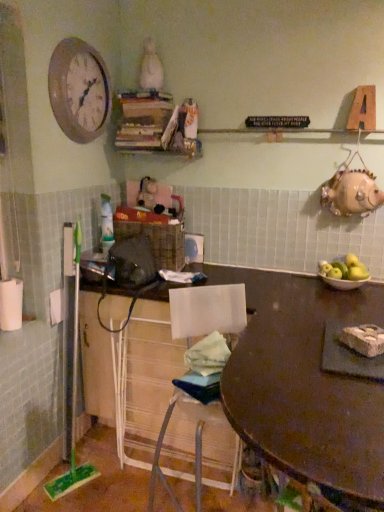
The height and width of the screenshot is (512, 384). What are the coordinates of `vacant space situated on the left part of white crumbly food at table` in the screenshot? It's located at (300, 345).